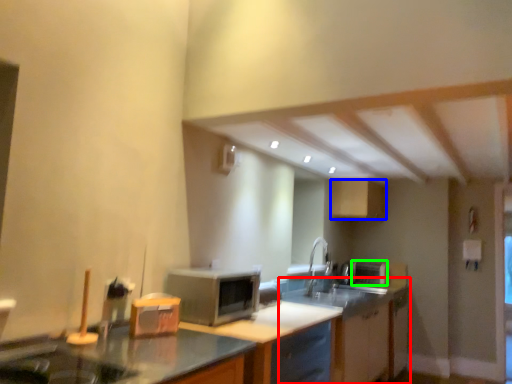
Question: Based on their relative distances, which object is nearer to cabinetry (highlighted by a red box)? Choose from cabinetry (highlighted by a blue box) and appliance (highlighted by a green box).

Choices:
 (A) cabinetry
 (B) appliance

Answer: (B)